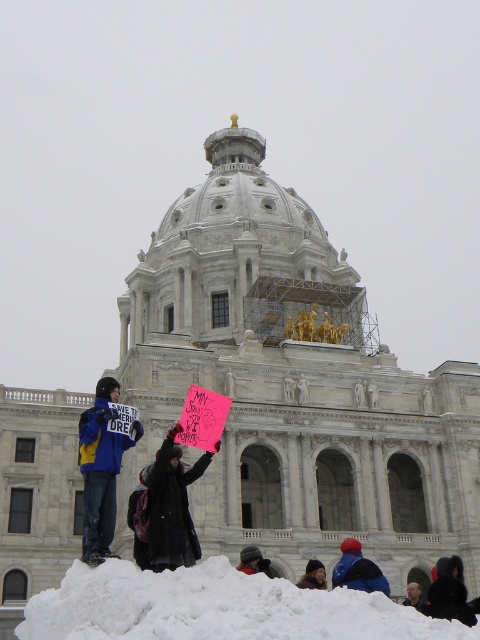
Question: Is white fluffy snow at lower center thinner than dark brown fur hat at lower center?

Choices:
 (A) no
 (B) yes

Answer: (A)

Question: Is blue denim jacket at lower left thinner than dark blue jacket at lower center?

Choices:
 (A) yes
 (B) no

Answer: (B)

Question: Among these points, which one is nearest to the camera?

Choices:
 (A) (359, 570)
 (B) (91, 417)
 (C) (467, 620)
 (D) (194, 566)

Answer: (D)

Question: Which point is farther from the camera taking this photo?

Choices:
 (A) (260, 554)
 (B) (339, 545)
 (C) (179, 461)
 (D) (408, 598)

Answer: (B)

Question: Is black fur coat at lower right further to the viewer compared to blue fabric at lower right?

Choices:
 (A) yes
 (B) no

Answer: (B)

Question: Which point is farther to the camera?

Choices:
 (A) (319, 564)
 (B) (90, 516)

Answer: (A)